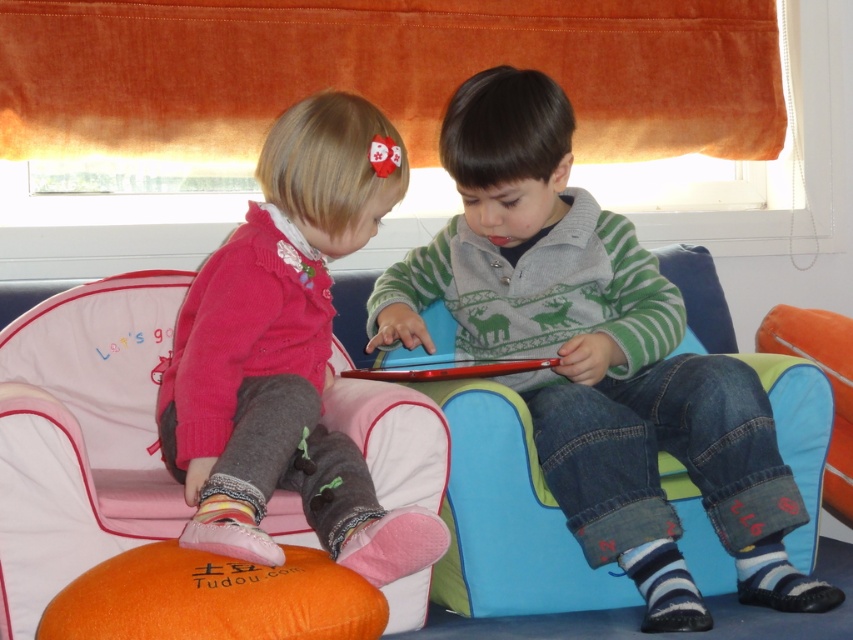
Question: Which point is closer to the camera?

Choices:
 (A) matte pink sweater at center
 (B) orange fabric bean bag at lower left
 (C) matte green sweater at center

Answer: (A)

Question: Which point is farther from the camera taking this photo?

Choices:
 (A) 193,440
 (B) 15,620
 (C) 421,342

Answer: (C)

Question: Does matte green sweater at center appear on the right side of matte pink sweater at center?

Choices:
 (A) yes
 (B) no

Answer: (A)

Question: Among these objects, which one is farthest from the camera?

Choices:
 (A) orange fabric bean bag at lower left
 (B) matte pink sweater at center
 (C) matte green sweater at center

Answer: (C)

Question: Observing the image, what is the correct spatial positioning of matte green sweater at center in reference to matte pink sweater at center?

Choices:
 (A) left
 (B) right

Answer: (B)

Question: Is matte green sweater at center bigger than orange fabric bean bag at lower left?

Choices:
 (A) no
 (B) yes

Answer: (B)